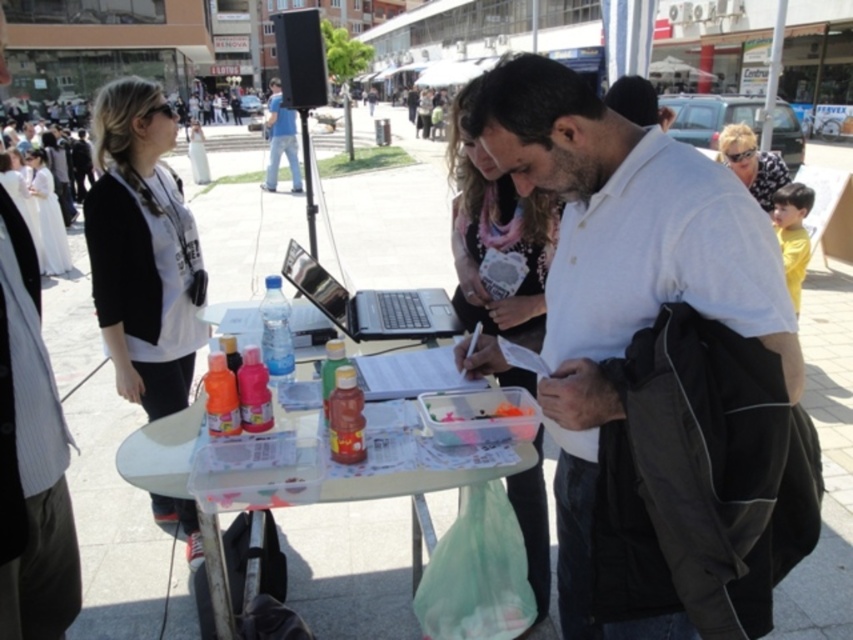
Between white matte shirt at center and translucent plastic container at center, which one has less height?

translucent plastic container at center

Who is higher up, white matte shirt at center or translucent plastic container at center?

white matte shirt at center

At what (x,y) coordinates should I click in order to perform the action: click on white matte shirt at center. Please return your answer as a coordinate pair (x, y). The width and height of the screenshot is (853, 640). Looking at the image, I should click on (621, 264).

Locate an element on the screen. This screenshot has height=640, width=853. white matte shirt at center is located at coordinates (621, 264).

Is point (33, 177) in front of point (293, 148)?

That is True.

In order to click on white satin dress at upper left in this screenshot , I will do `click(47, 216)`.

Which of these two, matte black jacket at left or matte pink scarf at center, stands shorter?

matte pink scarf at center is shorter.

Is matte black jacket at left bigger than matte pink scarf at center?

Yes, matte black jacket at left is bigger than matte pink scarf at center.

Which is in front, point (141, 356) or point (459, 131)?

Point (459, 131) is in front.

Where is `matte black jacket at left`? The image size is (853, 640). matte black jacket at left is located at coordinates (142, 250).